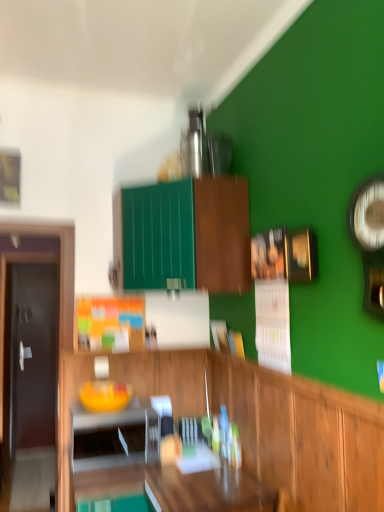
Locate an element on the screen. wooden table at center is located at coordinates (196, 490).

I want to click on white glossy microwave at lower left, so click(115, 437).

What do you see at coordinates (60, 266) in the screenshot? I see `dark brown wooden door at left` at bounding box center [60, 266].

Identify the location of metallic silver clock at right. (369, 239).

Where is `wooden table at center`? wooden table at center is located at coordinates (196, 490).

Is white glossy microwave at lower left far away from dark brown wooden door at left?

white glossy microwave at lower left is near dark brown wooden door at left, not far away.

Does white glossy microwave at lower left appear on the right side of dark brown wooden door at left?

Yes, white glossy microwave at lower left is to the right of dark brown wooden door at left.

Which object is further away from the camera taking this photo, white glossy microwave at lower left or dark brown wooden door at left?

dark brown wooden door at left is behind.

Considering the sizes of objects white glossy microwave at lower left and dark brown wooden door at left in the image provided, who is wider, white glossy microwave at lower left or dark brown wooden door at left?

white glossy microwave at lower left is wider.

Considering the sizes of objects green matte cabinet at upper center, the second cabinetry positioned from the bottom, and wooden table at center in the image provided, who is wider, green matte cabinet at upper center, the second cabinetry positioned from the bottom, or wooden table at center?

wooden table at center.

Are green matte cabinet at upper center, the second cabinetry positioned from the bottom, and wooden table at center making contact?

They are not placed beside each other.

Which of these two, green matte cabinet at upper center, the second cabinetry positioned from the bottom, or wooden table at center, stands shorter?

Standing shorter between the two is wooden table at center.

Is green matte cabinet at upper center, the second cabinetry positioned from the bottom, aimed at wooden table at center?

No.

Is wooden cabinet at center, placed as the 1th cabinetry when sorted from bottom to top, to the right of wooden table at center from the viewer's perspective?

Correct, you'll find wooden cabinet at center, placed as the 1th cabinetry when sorted from bottom to top, to the right of wooden table at center.

Is wooden cabinet at center, placed as the 1th cabinetry when sorted from bottom to top, not near wooden table at center?

wooden cabinet at center, placed as the 1th cabinetry when sorted from bottom to top, is actually quite close to wooden table at center.

From the wooden table at center, count 2nd cabinetry to the right and point to it. Please provide its 2D coordinates.

[(276, 423)]

How different are the orientations of wooden cabinet at center, placed as the 1th cabinetry when sorted from bottom to top, and wooden table at center in degrees?

The facing directions of wooden cabinet at center, placed as the 1th cabinetry when sorted from bottom to top, and wooden table at center are 0.231 degrees apart.

Can we say wooden table at center lies outside white glossy microwave at lower left?

Absolutely, wooden table at center is external to white glossy microwave at lower left.

Is wooden table at center turned away from white glossy microwave at lower left?

That's not correct — wooden table at center is not looking away from white glossy microwave at lower left.

Is wooden table at center not close to white glossy microwave at lower left?

That's not correct — wooden table at center is a little close to white glossy microwave at lower left.

From a real-world perspective, is wooden table at center physically above white glossy microwave at lower left?

No, from a real-world perspective, wooden table at center is not on top of white glossy microwave at lower left.

Does white glossy microwave at lower left have a greater height compared to green matte cabinet at upper center, the second cabinetry positioned from the bottom?

In fact, white glossy microwave at lower left may be shorter than green matte cabinet at upper center, the second cabinetry positioned from the bottom.

From a real-world perspective, which is physically above, white glossy microwave at lower left or green matte cabinet at upper center, the second cabinetry positioned from the bottom?

green matte cabinet at upper center, the second cabinetry positioned from the bottom, from a real-world perspective.

Is white glossy microwave at lower left directly adjacent to green matte cabinet at upper center, marked as the first cabinetry in a top-to-bottom arrangement?

There is a gap between white glossy microwave at lower left and green matte cabinet at upper center, marked as the first cabinetry in a top-to-bottom arrangement.

Is metallic silver clock at right located outside dark brown wooden door at left?

Yes.

In the scene shown: From the image's perspective, is metallic silver clock at right positioned above or below dark brown wooden door at left?

From the image's perspective, metallic silver clock at right appears above dark brown wooden door at left.

Is metallic silver clock at right far away from dark brown wooden door at left?

metallic silver clock at right is far away from dark brown wooden door at left.

Is metallic silver clock at right wider or thinner than dark brown wooden door at left?

metallic silver clock at right is wider than dark brown wooden door at left.

From a real-world perspective, which object stands above the other?

dark brown wooden door at left is physically above.

Looking at their sizes, would you say wooden cabinet at center, the 2th cabinetry positioned from the top, is wider or thinner than dark brown wooden door at left?

wooden cabinet at center, the 2th cabinetry positioned from the top, is wider than dark brown wooden door at left.

Which point is more distant from viewer, (313, 432) or (63, 340)?

The point (63, 340) is farther.

Can you tell me how much wooden cabinet at center, the 2th cabinetry positioned from the top, and dark brown wooden door at left differ in facing direction?

The angular difference between wooden cabinet at center, the 2th cabinetry positioned from the top, and dark brown wooden door at left is 89.1 degrees.

Locate an element on the screen. appliance located above the dark brown wooden door at left (from the image's perspective) is located at coordinates (115, 437).

Where is `cabinetry lying behind the wooden table at center`? The image size is (384, 512). cabinetry lying behind the wooden table at center is located at coordinates (184, 234).

Consider the image. Which object lies nearer to the anchor point metallic silver clock at right, green matte cabinet at upper center, marked as the first cabinetry in a top-to-bottom arrangement, or wooden table at center?

Result: green matte cabinet at upper center, marked as the first cabinetry in a top-to-bottom arrangement.

Considering their positions, is wooden cabinet at center, the 2th cabinetry positioned from the top, positioned closer to dark brown wooden door at left than green matte cabinet at upper center, marked as the first cabinetry in a top-to-bottom arrangement?

Based on the image, green matte cabinet at upper center, marked as the first cabinetry in a top-to-bottom arrangement, appears to be nearer to dark brown wooden door at left.

From the image, which object appears to be nearer to green matte cabinet at upper center, marked as the first cabinetry in a top-to-bottom arrangement, wooden table at center or metallic silver clock at right?

Among the two, metallic silver clock at right is located nearer to green matte cabinet at upper center, marked as the first cabinetry in a top-to-bottom arrangement.

Looking at the image, which one is located further to wooden table at center, metallic silver clock at right or wooden cabinet at center, the 2th cabinetry positioned from the top?

The object further to wooden table at center is metallic silver clock at right.

Estimate the real-world distances between objects in this image. Which object is closer to metallic silver clock at right, dark brown wooden door at left or wooden cabinet at center, the 2th cabinetry positioned from the top?

Based on the image, wooden cabinet at center, the 2th cabinetry positioned from the top, appears to be nearer to metallic silver clock at right.

From the picture: Based on their spatial positions, is white glossy microwave at lower left or wooden cabinet at center, placed as the 1th cabinetry when sorted from bottom to top, closer to metallic silver clock at right?

wooden cabinet at center, placed as the 1th cabinetry when sorted from bottom to top, is closer to metallic silver clock at right.

Estimate the real-world distances between objects in this image. Which object is closer to wooden cabinet at center, placed as the 1th cabinetry when sorted from bottom to top, dark brown wooden door at left or metallic silver clock at right?

The object closer to wooden cabinet at center, placed as the 1th cabinetry when sorted from bottom to top, is metallic silver clock at right.

Consider the image. Considering their positions, is wooden table at center positioned closer to metallic silver clock at right than green matte cabinet at upper center, marked as the first cabinetry in a top-to-bottom arrangement?

The object closer to metallic silver clock at right is green matte cabinet at upper center, marked as the first cabinetry in a top-to-bottom arrangement.

Locate an element on the screen. The image size is (384, 512). appliance between green matte cabinet at upper center, the second cabinetry positioned from the bottom, and wooden table at center vertically is located at coordinates (115, 437).

The height and width of the screenshot is (512, 384). In order to click on appliance between wooden table at center and dark brown wooden door at left along the z-axis in this screenshot , I will do `click(115, 437)`.

Find the location of a particular element. The width and height of the screenshot is (384, 512). appliance between wooden cabinet at center, placed as the 1th cabinetry when sorted from bottom to top, and dark brown wooden door at left from front to back is located at coordinates pyautogui.click(x=115, y=437).

Where is `cabinetry between metallic silver clock at right and wooden table at center in the up-down direction`? The width and height of the screenshot is (384, 512). cabinetry between metallic silver clock at right and wooden table at center in the up-down direction is located at coordinates (276, 423).